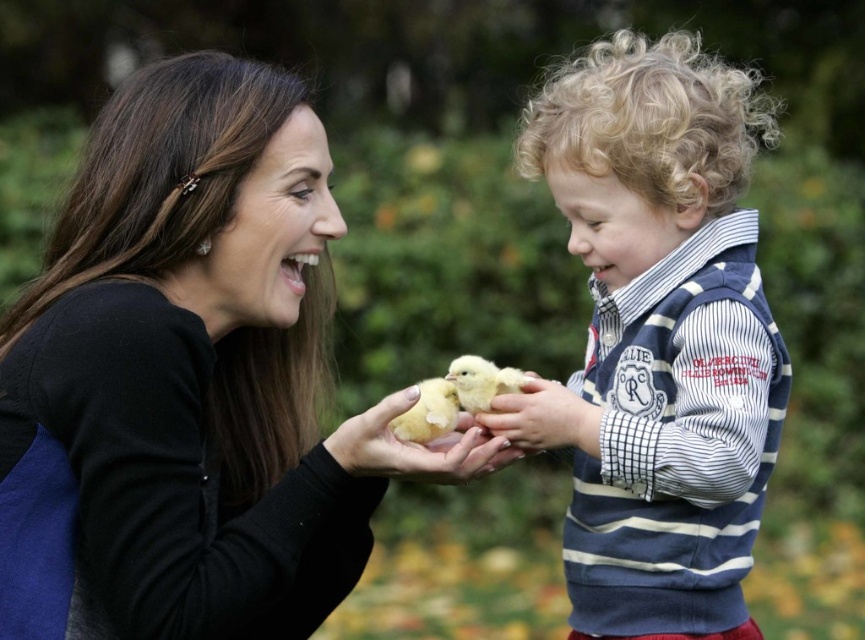
Does yellow soft feathers at center have a smaller size compared to soft yellow feathers at center?

Actually, yellow soft feathers at center might be larger than soft yellow feathers at center.

Looking at this image, which of these two, yellow soft feathers at center or soft yellow feathers at center, stands shorter?

soft yellow feathers at center

Locate an element on the screen. The image size is (865, 640). yellow soft feathers at center is located at coordinates (415, 445).

Can you confirm if soft yellow chick at center is thinner than yellow soft feathers at center?

→ In fact, soft yellow chick at center might be wider than yellow soft feathers at center.

Where is `soft yellow chick at center`? soft yellow chick at center is located at coordinates (663, 333).

Does point (639, 115) come in front of point (498, 451)?

That is False.

Image resolution: width=865 pixels, height=640 pixels. Find the location of `soft yellow chick at center`. soft yellow chick at center is located at coordinates (663, 333).

Is soft yellow chick at center wider than soft yellow feathers at center?

Yes.

Is soft yellow chick at center below soft yellow feathers at center?

Incorrect, soft yellow chick at center is not positioned below soft yellow feathers at center.

You are a GUI agent. You are given a task and a screenshot of the screen. Output one action in this format:
    pyautogui.click(x=<x>, y=<y>)
    Task: Click on the soft yellow chick at center
    This screenshot has width=865, height=640.
    Given the screenshot: What is the action you would take?
    pyautogui.click(x=663, y=333)

Identify the location of soft yellow chick at center. Image resolution: width=865 pixels, height=640 pixels. (663, 333).